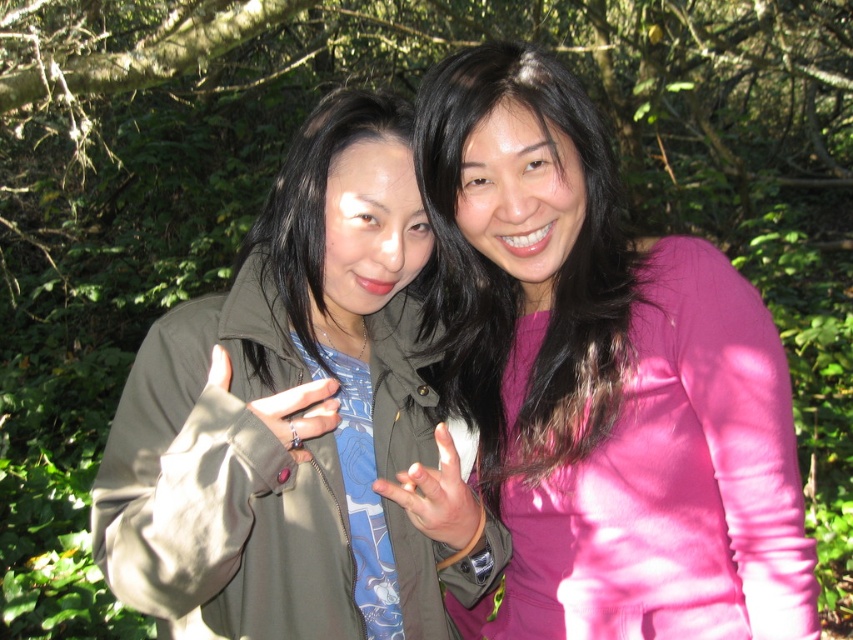
You are a photographer trying to capture a closeup of the pink satin blouse at center and the matte green jacket at center. Which one is positioned higher in the frame?

The pink satin blouse at center is above the matte green jacket at center, so it is positioned higher in the frame.

You are a photographer trying to capture a closeup of the pink matte shirt at center and the matte black ring at center. Which object should you adjust your camera to focus on first if you want to ensure both are in the frame without moving the camera?

The pink matte shirt at center is to the right of the matte black ring at center, so you should focus on the matte black ring at center first to ensure both objects remain in the frame without moving the camera.

You are a photographer trying to capture a closeup shot of both the pink satin blouse at center and the matte green jacket at center. The camera you are using has a maximum focus range of 10 inches. Can you fit both objects within the camera frame without moving the camera?

The pink satin blouse at center and the matte green jacket at center are 10.92 inches apart from each other, which exceeds the camera maximum focus range of 10 inches. Therefore, you cannot fit both objects within the camera frame without moving the camera.